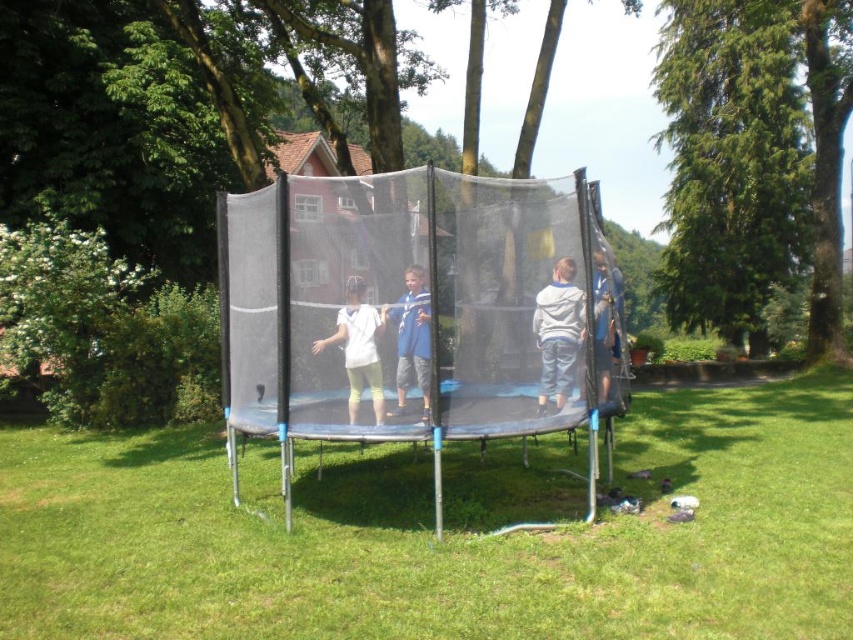
Between gray fleece jacket at center and blue cotton shirt at center, which one is positioned higher?

gray fleece jacket at center

Can you confirm if gray fleece jacket at center is wider than blue cotton shirt at center?

Yes, gray fleece jacket at center is wider than blue cotton shirt at center.

Locate an element on the screen. gray fleece jacket at center is located at coordinates (558, 332).

Between black mesh net at center and gray fleece jacket at center, which one appears on the left side from the viewer's perspective?

black mesh net at center is more to the left.

Is black mesh net at center wider than gray fleece jacket at center?

Indeed, black mesh net at center has a greater width compared to gray fleece jacket at center.

Between point (486, 390) and point (567, 376), which one is positioned behind?

Positioned behind is point (567, 376).

What are the coordinates of `black mesh net at center` in the screenshot? It's located at (405, 314).

Does point (397, 518) lie in front of point (386, 312)?

No, it is behind (386, 312).

Is black rubber trampoline at center to the right of blue cotton shirt at center from the viewer's perspective?

In fact, black rubber trampoline at center is to the left of blue cotton shirt at center.

Which is behind, point (817, 566) or point (428, 339)?

The point (428, 339) is behind.

Image resolution: width=853 pixels, height=640 pixels. I want to click on black rubber trampoline at center, so (x=445, y=536).